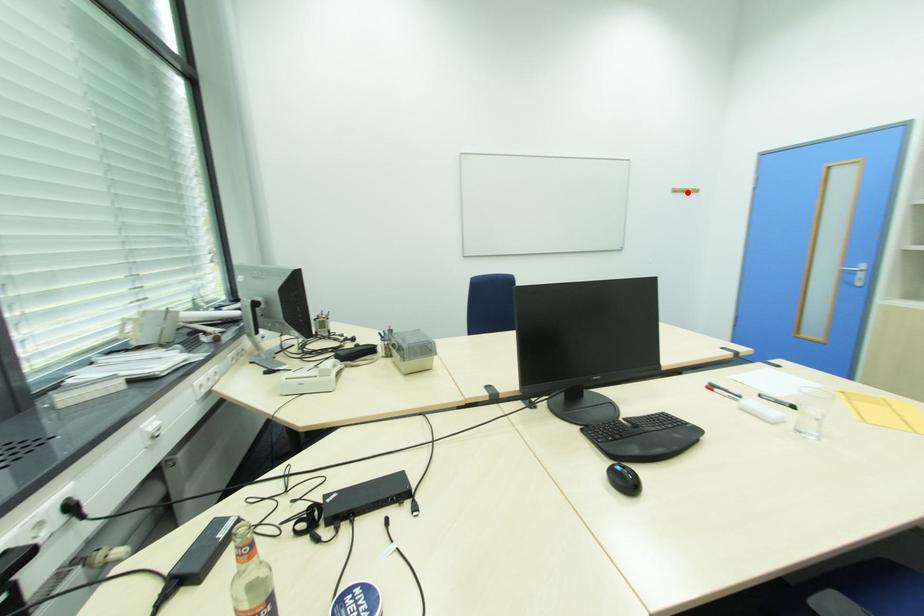
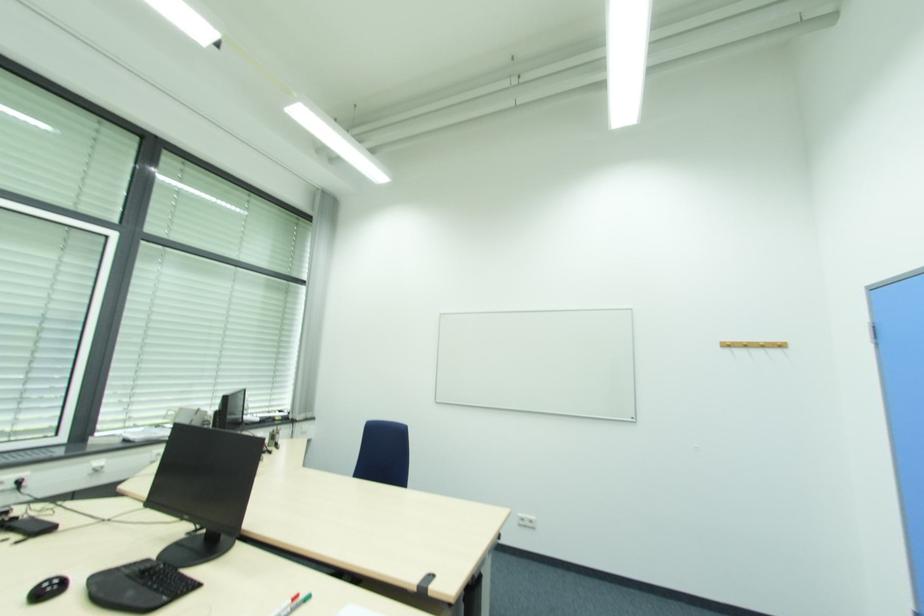
Where in the second image is the point corresponding to the highlighted location from the first image?

(748, 346)